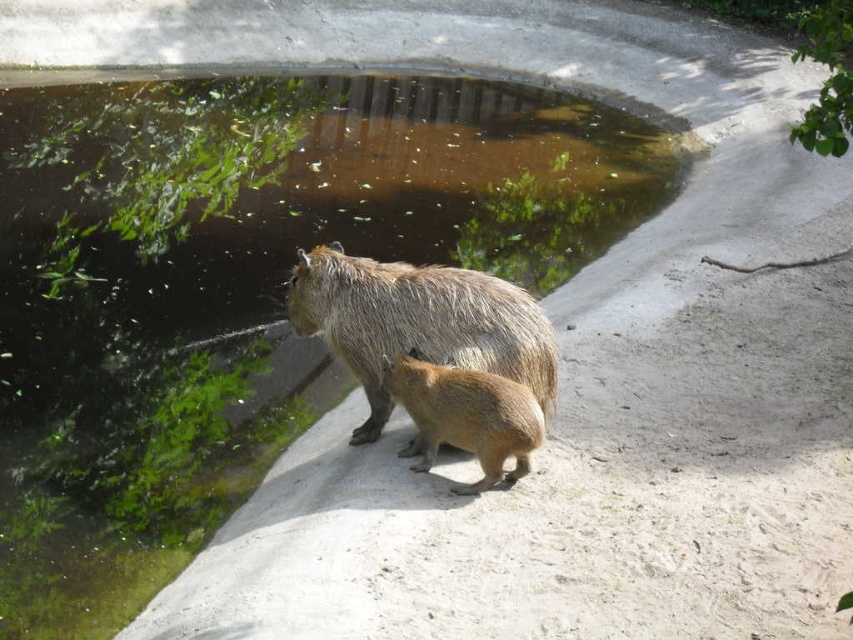
You are a zookeeper trying to determine the best path to reach the brown furry capybara at center without disturbing the green mossy water at center. Since the water is thinner, which direction should you approach from?

The green mossy water at center is thinner than the brown furry capybara at center, so approaching from the direction where the water is narrower would be less disruptive. However, since the water is at the center, approaching from either side of the brown furry capybara at center might be better to avoid the thinner water area.

You are a photographer standing at the edge of the water, and you want to take a photo of the two points in the scene. Which point, point (384,412) or point (430,426), will appear closer to the camera in your photo?

Point (384,412) is further to the camera than point (430,426), so it will appear closer to the camera in the photo.

You are a zookeeper who needs to ensure the fuzzy brown capybara at center has enough space to move freely. Based on the scene, is the green mossy water at center taking up too much space compared to the capybara?

The green mossy water at center is thinner than the fuzzy brown capybara at center, meaning it occupies less space. Therefore, the water is not taking up too much space and the capybara has sufficient room to move freely.